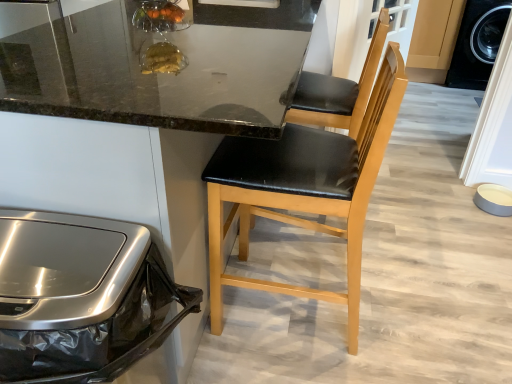
Question: Is stainless steel trash can at left shorter than black leather chair at center?

Choices:
 (A) no
 (B) yes

Answer: (B)

Question: Is stainless steel trash can at left further to camera compared to black leather chair at center?

Choices:
 (A) yes
 (B) no

Answer: (B)

Question: Considering the relative sizes of stainless steel trash can at left and black leather chair at center in the image provided, is stainless steel trash can at left smaller than black leather chair at center?

Choices:
 (A) no
 (B) yes

Answer: (B)

Question: Considering the relative sizes of stainless steel trash can at left and black leather chair at center in the image provided, is stainless steel trash can at left wider than black leather chair at center?

Choices:
 (A) yes
 (B) no

Answer: (B)

Question: Is stainless steel trash can at left at the left side of black leather chair at center?

Choices:
 (A) no
 (B) yes

Answer: (B)

Question: From a real-world perspective, relative to black leather chair at center, is matte gray bowl at lower right vertically above or below?

Choices:
 (A) above
 (B) below

Answer: (B)

Question: Considering the positions of point (x=480, y=200) and point (x=292, y=61), is point (x=480, y=200) closer or farther from the camera than point (x=292, y=61)?

Choices:
 (A) closer
 (B) farther

Answer: (B)

Question: Considering the positions of matte gray bowl at lower right and black leather chair at center in the image, is matte gray bowl at lower right bigger or smaller than black leather chair at center?

Choices:
 (A) small
 (B) big

Answer: (A)

Question: Is matte gray bowl at lower right taller or shorter than black leather chair at center?

Choices:
 (A) short
 (B) tall

Answer: (A)

Question: From a real-world perspective, is black leather chair at center positioned above or below black leather chair at center?

Choices:
 (A) below
 (B) above

Answer: (A)

Question: In terms of width, does black leather chair at center look wider or thinner when compared to black leather chair at center?

Choices:
 (A) wide
 (B) thin

Answer: (B)

Question: Considering the positions of black leather chair at center and black leather chair at center in the image, is black leather chair at center taller or shorter than black leather chair at center?

Choices:
 (A) short
 (B) tall

Answer: (A)

Question: Is black leather chair at center situated inside black leather chair at center or outside?

Choices:
 (A) outside
 (B) inside

Answer: (B)

Question: Looking at the image, does black leather chair at center seem bigger or smaller compared to matte gray bowl at lower right?

Choices:
 (A) big
 (B) small

Answer: (A)

Question: From their relative heights in the image, would you say black leather chair at center is taller or shorter than matte gray bowl at lower right?

Choices:
 (A) short
 (B) tall

Answer: (B)